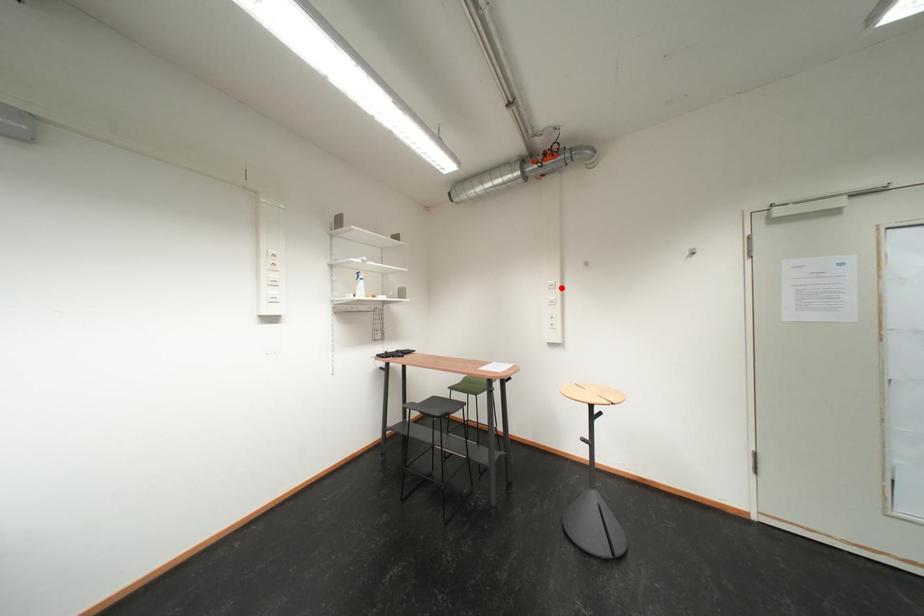
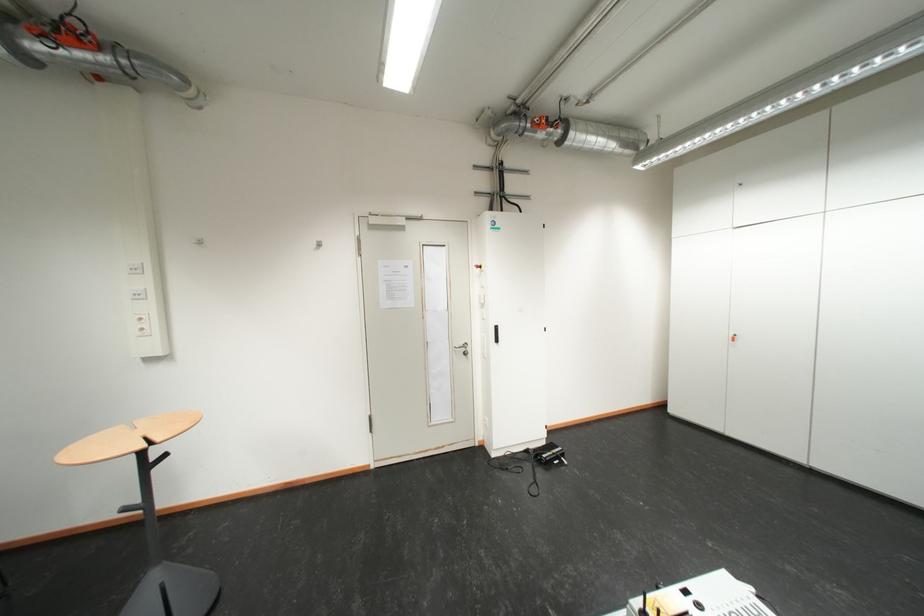
Find the pixel in the second image that matches the highlighted location in the first image.

(144, 272)